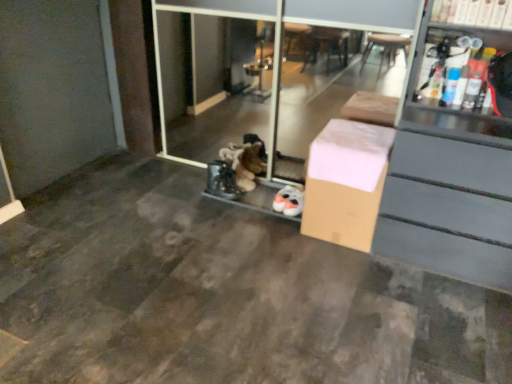
Question: Is brown cardboard box at center touching white cardboard box at upper right?

Choices:
 (A) yes
 (B) no

Answer: (B)

Question: Can you confirm if brown cardboard box at center is bigger than white cardboard box at upper right?

Choices:
 (A) no
 (B) yes

Answer: (B)

Question: From the image's perspective, is brown cardboard box at center located beneath white cardboard box at upper right?

Choices:
 (A) no
 (B) yes

Answer: (B)

Question: Does brown cardboard box at center contain white cardboard box at upper right?

Choices:
 (A) yes
 (B) no

Answer: (B)

Question: Is brown cardboard box at center positioned behind white cardboard box at upper right?

Choices:
 (A) yes
 (B) no

Answer: (A)

Question: From a real-world perspective, is brown cardboard box at center physically located above or below white cardboard box at upper right?

Choices:
 (A) above
 (B) below

Answer: (B)

Question: In terms of size, does brown cardboard box at center appear bigger or smaller than white cardboard box at upper right?

Choices:
 (A) small
 (B) big

Answer: (B)

Question: In terms of height, does brown cardboard box at center look taller or shorter compared to white cardboard box at upper right?

Choices:
 (A) short
 (B) tall

Answer: (B)

Question: Would you say brown cardboard box at center is inside or outside white cardboard box at upper right?

Choices:
 (A) outside
 (B) inside

Answer: (A)

Question: Is brown cardboard box at center spatially inside transparent glass screen door at center, or outside of it?

Choices:
 (A) inside
 (B) outside

Answer: (B)

Question: From their relative heights in the image, would you say brown cardboard box at center is taller or shorter than transparent glass screen door at center?

Choices:
 (A) tall
 (B) short

Answer: (B)

Question: From a real-world perspective, is brown cardboard box at center above or below transparent glass screen door at center?

Choices:
 (A) above
 (B) below

Answer: (B)

Question: Is point (337, 152) positioned closer to the camera than point (170, 72)?

Choices:
 (A) farther
 (B) closer

Answer: (B)

Question: From a real-world perspective, is white cardboard box at upper right above or below brown cardboard box at center?

Choices:
 (A) below
 (B) above

Answer: (B)

Question: Is white cardboard box at upper right taller or shorter than brown cardboard box at center?

Choices:
 (A) short
 (B) tall

Answer: (A)